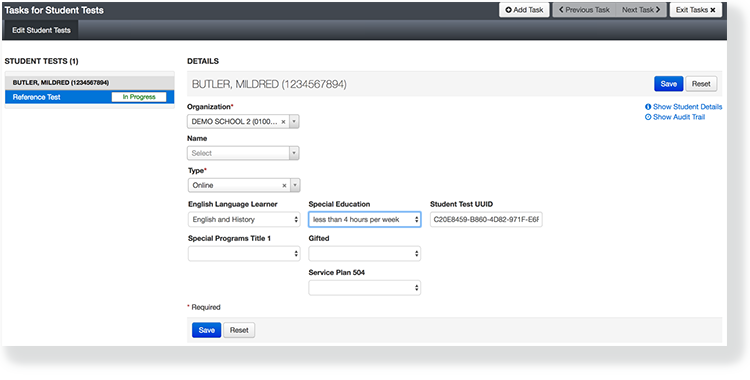
Identify the location of special education entry area. (348, 218).